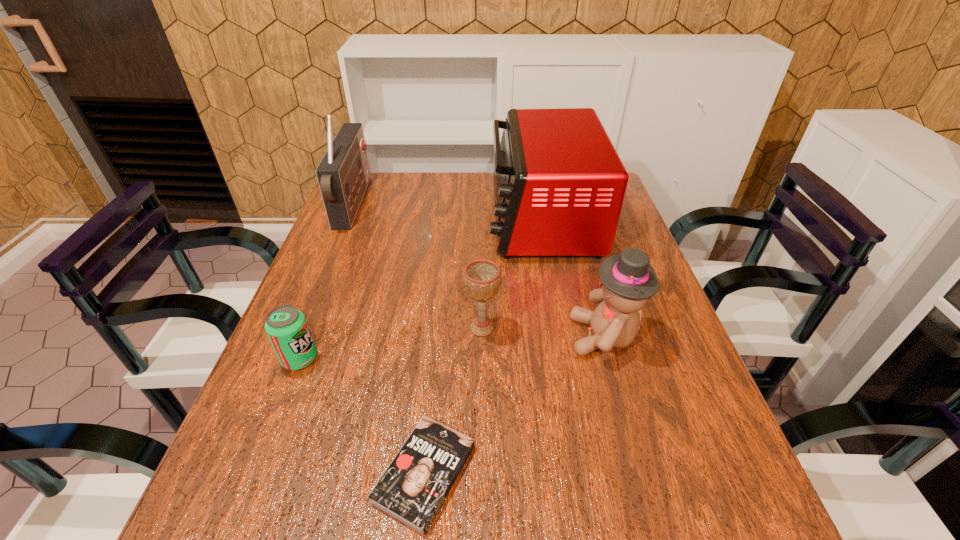
Find the location of a particular element. This screenshot has height=540, width=960. radio receiver is located at coordinates (343, 174).

This screenshot has height=540, width=960. Identify the location of toaster oven. (559, 185).

You are a GUI agent. You are given a task and a screenshot of the screen. Output one action in this format:
    pyautogui.click(x=<x>, y=<y>)
    Task: Click on the rag_doll
    
    Given the screenshot: What is the action you would take?
    pyautogui.click(x=628, y=280)

Where is `the fourth tallest object`? the fourth tallest object is located at coordinates (482, 278).

You are a GUI agent. You are given a task and a screenshot of the screen. Output one action in this format:
    pyautogui.click(x=<x>, y=<y>)
    Task: Click on the fifth tallest object
    
    Given the screenshot: What is the action you would take?
    pyautogui.click(x=287, y=329)

What are the coordinates of `the shortest object` in the screenshot? It's located at (414, 486).

Find the location of a particular element. the nearest object is located at coordinates click(x=414, y=486).

Where is `free location located 0.140m on the front panel of the radio receiver`? free location located 0.140m on the front panel of the radio receiver is located at coordinates (408, 204).

This screenshot has width=960, height=540. In order to click on free space located 0.320m on the front-facing side of the toaster oven in this screenshot , I will do `click(383, 219)`.

The height and width of the screenshot is (540, 960). Identify the location of free space located on the front-facing side of the toaster oven. (413, 219).